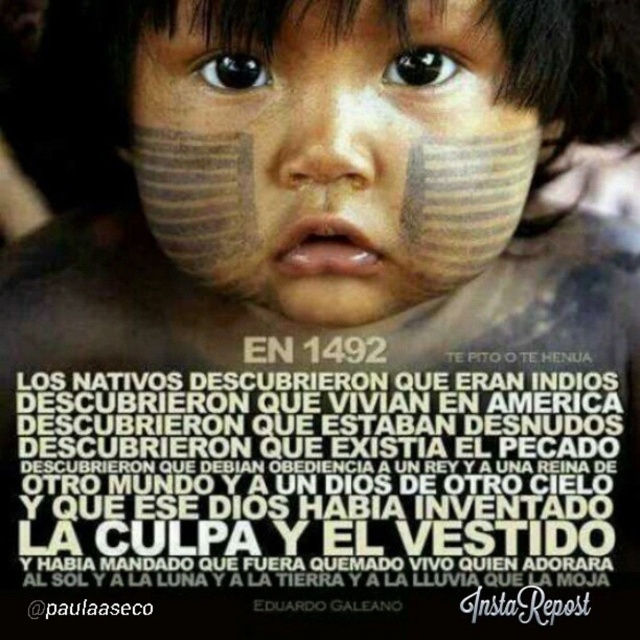
Does white paper text at center appear under matte skin forehead at upper center?

Yes.

Is white paper text at center smaller than matte skin forehead at upper center?

No.

Which is behind, point (131, 500) or point (198, 26)?

Positioned behind is point (131, 500).

Image resolution: width=640 pixels, height=640 pixels. Identify the location of white paper text at center. (317, 483).

Can you confirm if matte clay face at center is positioned to the left of matte skin forehead at upper center?

In fact, matte clay face at center is to the right of matte skin forehead at upper center.

Which of these two, matte clay face at center or matte skin forehead at upper center, stands taller?

matte clay face at center is taller.

The width and height of the screenshot is (640, 640). Describe the element at coordinates (332, 157) in the screenshot. I see `matte clay face at center` at that location.

Find the location of a particular element. matte clay face at center is located at coordinates (332, 157).

Can you confirm if white paper text at center is smaller than matte clay face at center?

Actually, white paper text at center might be larger than matte clay face at center.

Is point (612, 554) positioned after point (218, 161)?

That is False.

Is point (525, 529) positioned behind point (269, 109)?

Yes, point (525, 529) is farther from viewer.

What are the coordinates of `white paper text at center` in the screenshot? It's located at (317, 483).